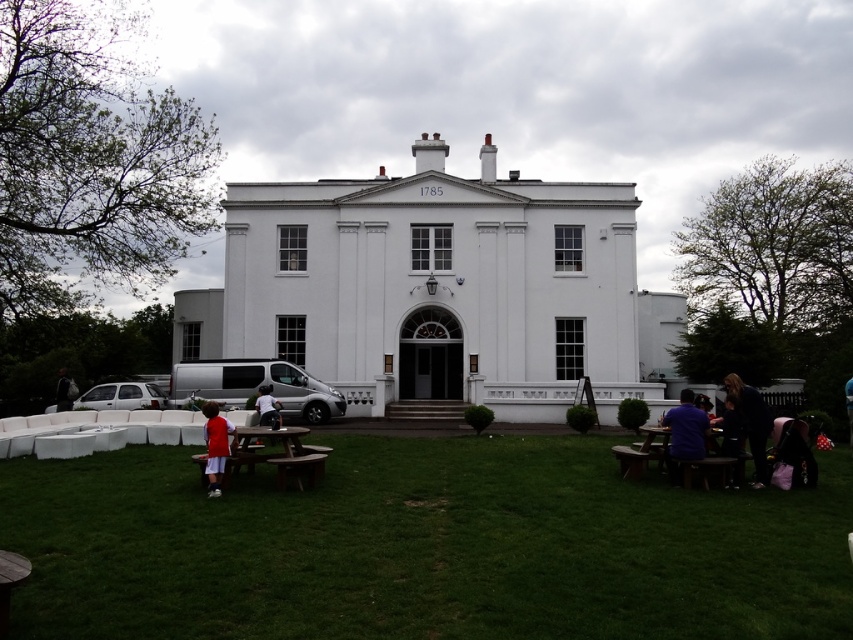
Can you confirm if brown wooden picnic table at lower center is positioned below dark blue fabric at right?

Yes, brown wooden picnic table at lower center is below dark blue fabric at right.

Is point (308, 472) closer to camera compared to point (755, 465)?

Yes, it is in front of point (755, 465).

Identify the location of brown wooden picnic table at lower center. (277, 452).

Which is above, green grass at lower center or matte red shirt at lower left?

Positioned higher is matte red shirt at lower left.

This screenshot has height=640, width=853. Describe the element at coordinates (422, 547) in the screenshot. I see `green grass at lower center` at that location.

Which is behind, point (223, 548) or point (210, 444)?

The point (210, 444) is behind.

You are a GUI agent. You are given a task and a screenshot of the screen. Output one action in this format:
    pyautogui.click(x=<x>, y=<y>)
    Task: Click on the green grass at lower center
    The image size is (853, 640).
    Given the screenshot: What is the action you would take?
    pyautogui.click(x=422, y=547)

Does point (204, 435) lie in front of point (685, 444)?

That is False.

Which is above, brown wooden picnic table at lower center or purple shirt at lower right?

purple shirt at lower right

Who is more distant from viewer, (222, 483) or (669, 449)?

The point (669, 449) is more distant.

What are the coordinates of `brown wooden picnic table at lower center` in the screenshot? It's located at point(277,452).